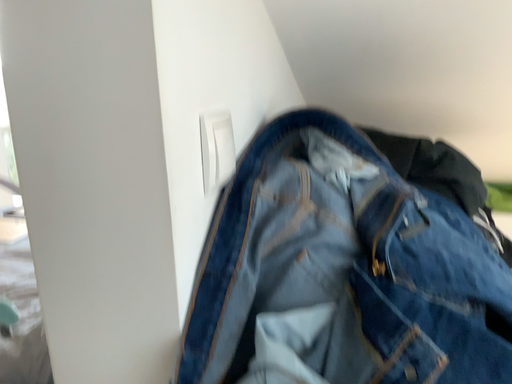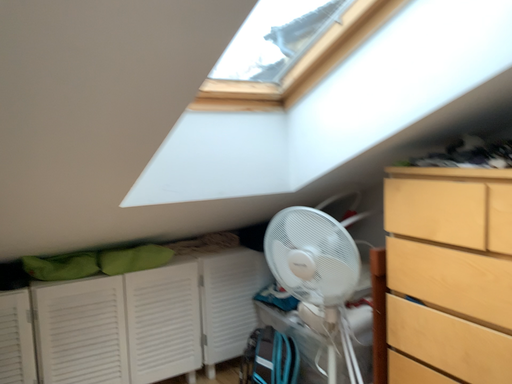
Question: How did the camera likely rotate when shooting the video?

Choices:
 (A) rotated downward
 (B) rotated upward

Answer: (B)